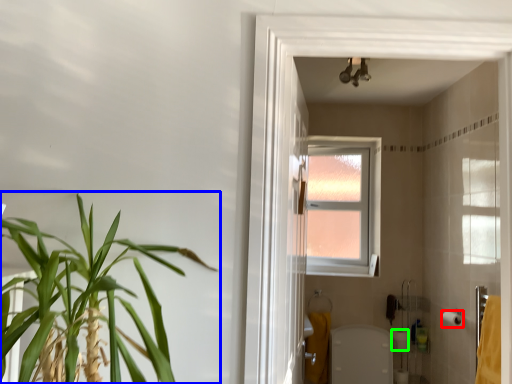
Question: Which object is the closest to the toilet paper (highlighted by a red box)? Choose among these: houseplant (highlighted by a blue box) or toilet paper (highlighted by a green box).

Choices:
 (A) houseplant
 (B) toilet paper

Answer: (B)